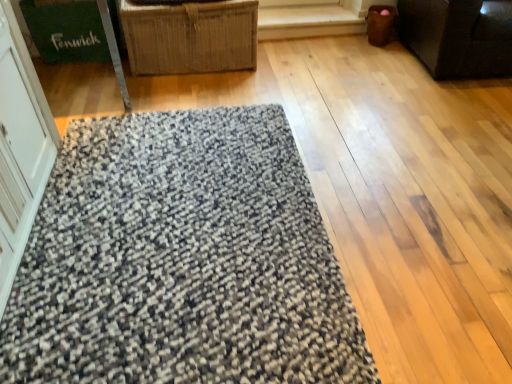
The height and width of the screenshot is (384, 512). I want to click on vacant area that lies to the right of textured gray mat at center, so click(x=415, y=221).